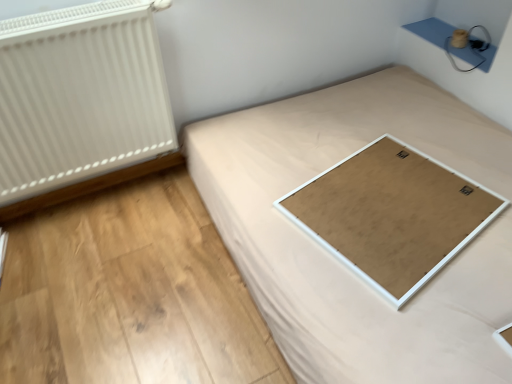
Locate an element on the screen. This screenshot has width=512, height=384. free spot below white textured radiator at left (from a real-world perspective) is located at coordinates (108, 195).